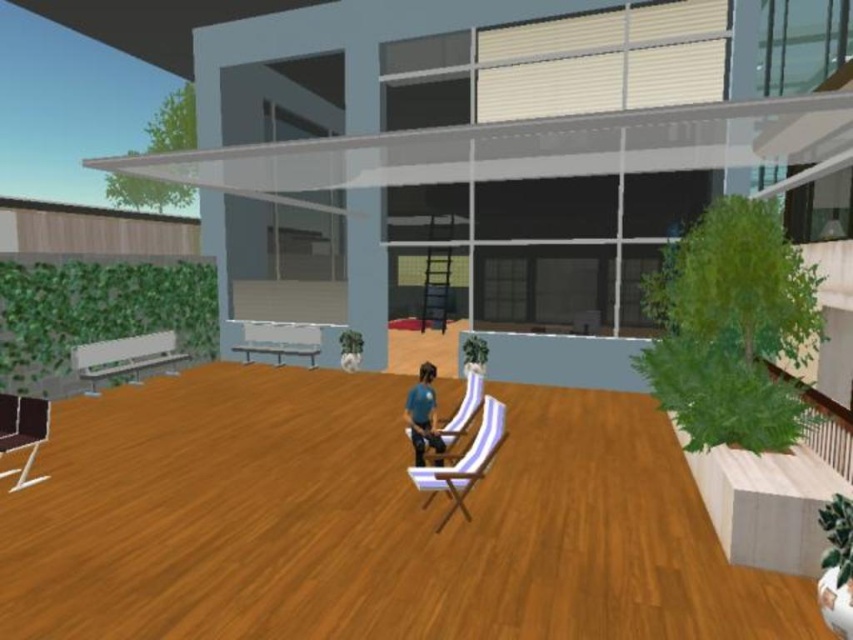
You are planning to host a small gathering and need to seat four people. You have two chairs available on the patio. The striped fabric chair at center and the dark brown leather armchair at lower left. Considering their sizes, which chair would be more suitable for accommodating a larger guest?

The dark brown leather armchair at lower left has a greater width than the striped fabric chair at center, making it more suitable for accommodating a larger guest due to its larger size.

Consider the image. You are a guest at this patio and want to sit as close as possible to the building. Which chair should you choose between the striped fabric chair at center and the dark brown leather armchair at lower left?

The striped fabric chair at center is in front of the dark brown leather armchair at lower left, so the dark brown leather armchair at lower left is closer to the building. You should choose the dark brown leather armchair at lower left.